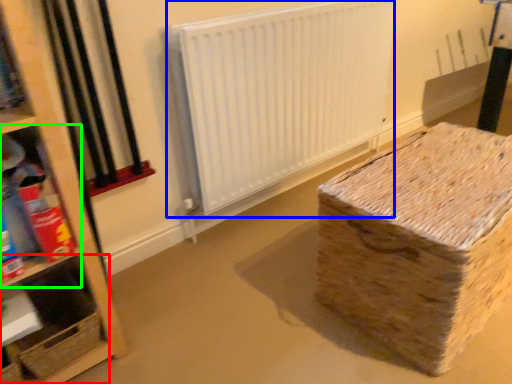
Question: Considering the real-world distances, which object is closest to shelf (highlighted by a red box)? radiator (highlighted by a blue box) or shelf (highlighted by a green box).

Choices:
 (A) radiator
 (B) shelf

Answer: (B)